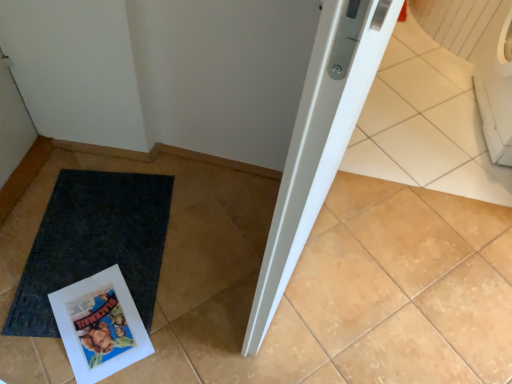
Describe the element at coordinates (100, 325) in the screenshot. The height and width of the screenshot is (384, 512). I see `white glossy comic book at lower left` at that location.

I want to click on white glossy comic book at lower left, so point(100,325).

In order to face black rubber mat at lower left, should I rotate leftwards or rightwards?

You should rotate left by 20.162 degrees.

Identify the location of black rubber mat at lower left. The width and height of the screenshot is (512, 384). (94, 243).

The height and width of the screenshot is (384, 512). What do you see at coordinates (94, 243) in the screenshot?
I see `black rubber mat at lower left` at bounding box center [94, 243].

Image resolution: width=512 pixels, height=384 pixels. Identify the location of white glossy comic book at lower left. (100, 325).

Would you say black rubber mat at lower left is to the left or to the right of white glossy comic book at lower left in the picture?

From the image, it's evident that black rubber mat at lower left is to the left of white glossy comic book at lower left.

From the picture: Between black rubber mat at lower left and white glossy comic book at lower left, which one is positioned behind?

black rubber mat at lower left is further away from the camera.

Considering the positions of points (121, 223) and (92, 325), is point (121, 223) closer to camera compared to point (92, 325)?

No, it is behind (92, 325).

From the image's perspective, which is above, black rubber mat at lower left or white glossy comic book at lower left?

black rubber mat at lower left is shown above in the image.

From a real-world perspective, is black rubber mat at lower left on white glossy comic book at lower left?

No, from a real-world perspective, black rubber mat at lower left is not above white glossy comic book at lower left.

Can you confirm if black rubber mat at lower left is thinner than white glossy comic book at lower left?

Incorrect, the width of black rubber mat at lower left is not less than that of white glossy comic book at lower left.

Is black rubber mat at lower left taller or shorter than white glossy comic book at lower left?

Clearly, black rubber mat at lower left is shorter compared to white glossy comic book at lower left.

Does black rubber mat at lower left have a smaller size compared to white glossy comic book at lower left?

No.

Is black rubber mat at lower left situated inside white glossy comic book at lower left or outside?

black rubber mat at lower left is spatially situated outside white glossy comic book at lower left.

Is black rubber mat at lower left next to white glossy comic book at lower left and touching it?

No, black rubber mat at lower left is not making contact with white glossy comic book at lower left.

Is white glossy comic book at lower left at the back of black rubber mat at lower left?

black rubber mat at lower left is not turned away from white glossy comic book at lower left.

I want to click on mat lying behind the white glossy comic book at lower left, so click(x=94, y=243).

Is white glossy comic book at lower left at the right side of black rubber mat at lower left?

Indeed, white glossy comic book at lower left is positioned on the right side of black rubber mat at lower left.

Which object is further away from the camera, white glossy comic book at lower left or black rubber mat at lower left?

black rubber mat at lower left is more distant.

Is point (116, 358) positioned behind point (141, 195)?

No, it is not.

From the image's perspective, is white glossy comic book at lower left over black rubber mat at lower left?

No, from the image's perspective, white glossy comic book at lower left is not on top of black rubber mat at lower left.

From a real-world perspective, which is physically above, white glossy comic book at lower left or black rubber mat at lower left?

white glossy comic book at lower left.

Based on the photo, looking at their sizes, would you say white glossy comic book at lower left is wider or thinner than black rubber mat at lower left?

In the image, white glossy comic book at lower left appears to be more narrow than black rubber mat at lower left.

Considering the sizes of objects white glossy comic book at lower left and black rubber mat at lower left in the image provided, who is shorter, white glossy comic book at lower left or black rubber mat at lower left?

black rubber mat at lower left.

Based on their sizes in the image, would you say white glossy comic book at lower left is bigger or smaller than black rubber mat at lower left?

Considering their sizes, white glossy comic book at lower left takes up less space than black rubber mat at lower left.

Based on the photo, do you think white glossy comic book at lower left is within black rubber mat at lower left, or outside of it?

white glossy comic book at lower left can be found inside black rubber mat at lower left.

Is white glossy comic book at lower left next to black rubber mat at lower left?

They are not placed beside each other.

Is white glossy comic book at lower left aimed at black rubber mat at lower left?

Yes, white glossy comic book at lower left is aimed at black rubber mat at lower left.

Measure the distance between white glossy comic book at lower left and black rubber mat at lower left.

13.32 centimeters.

The image size is (512, 384). I want to click on mat behind the white glossy comic book at lower left, so click(x=94, y=243).

Locate an element on the screen. This screenshot has height=384, width=512. mat beneath the white glossy comic book at lower left (from a real-world perspective) is located at coordinates (94, 243).

I want to click on comic book on the right of black rubber mat at lower left, so click(100, 325).